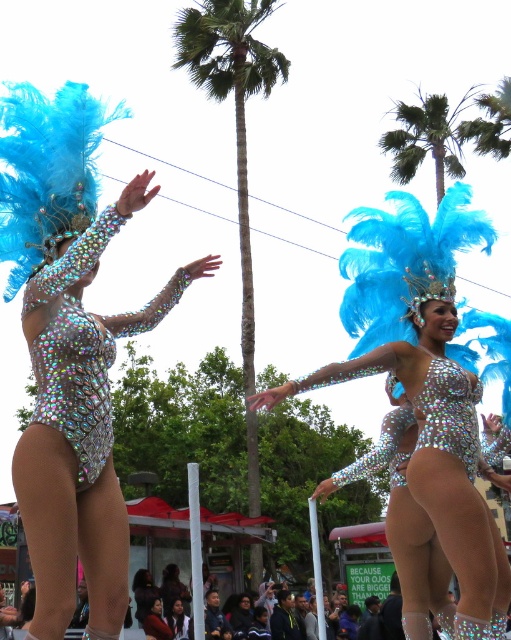
Question: Observing the image, what is the correct spatial positioning of iridescent sequined bodysuit at center in reference to green leafy palm tree at upper center?

Choices:
 (A) below
 (B) above

Answer: (A)

Question: Is green leafy palm tree at upper center to the right of matte black jacket at lower center from the viewer's perspective?

Choices:
 (A) yes
 (B) no

Answer: (A)

Question: Which is farther from the green leafy palm tree at upper center?

Choices:
 (A) matte black hair at center
 (B) iridescent sequined bodysuit at center
 (C) holographic sequin bodysuit at center
 (D) green textured palm tree at center

Answer: (B)

Question: Based on their relative distances, which object is farther from the green textured palm tree at center?

Choices:
 (A) iridescent sequined bodysuit at center
 (B) matte black hair at center

Answer: (A)

Question: Which point is farther to the camera?

Choices:
 (A) (212, 35)
 (B) (156, 627)
 (C) (45, 330)

Answer: (A)

Question: Is green textured palm tree at center bigger than matte black jacket at lower center?

Choices:
 (A) yes
 (B) no

Answer: (A)